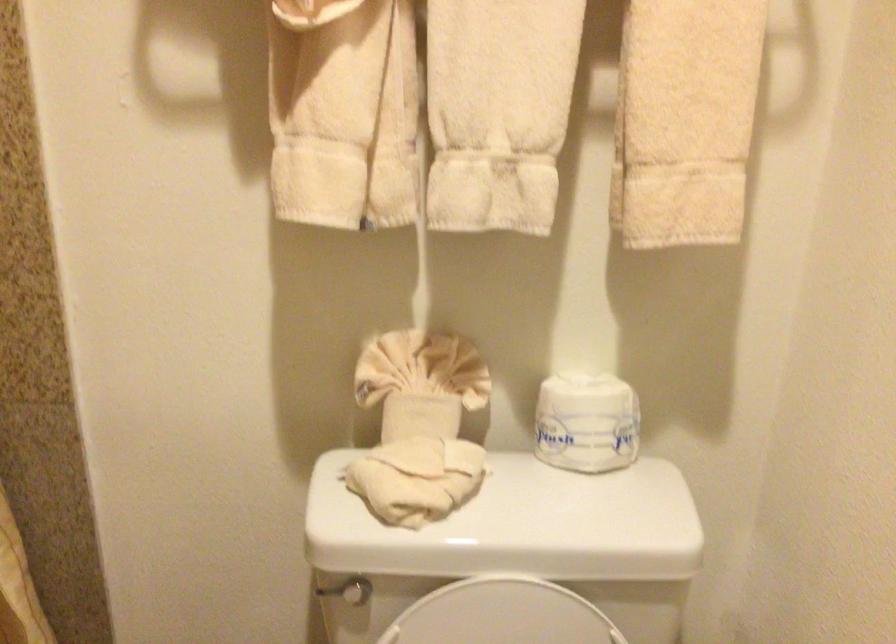
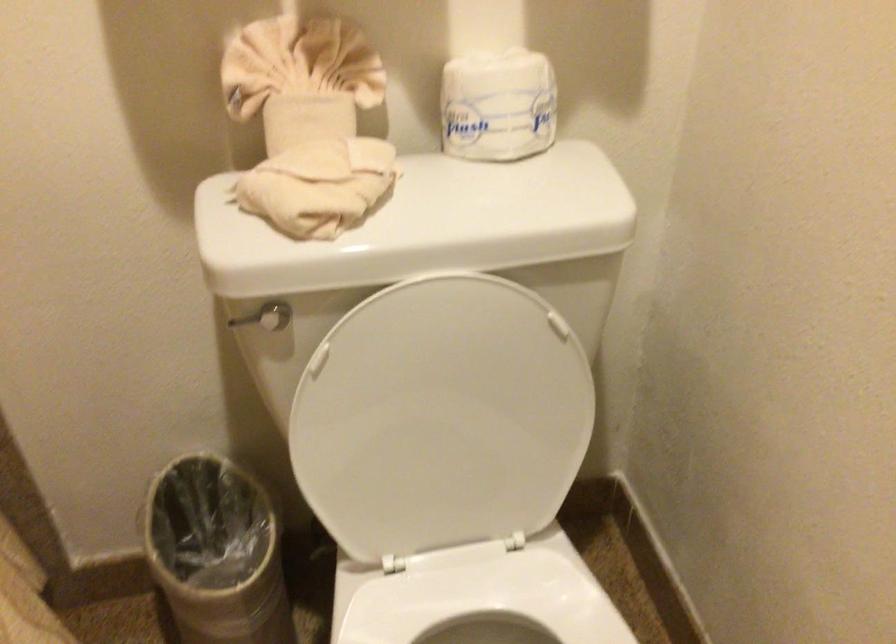
Question: The images are taken continuously from a first-person perspective. In which direction is your viewpoint rotating?

Choices:
 (A) Left
 (B) Right
 (C) Up
 (D) Down

Answer: (D)